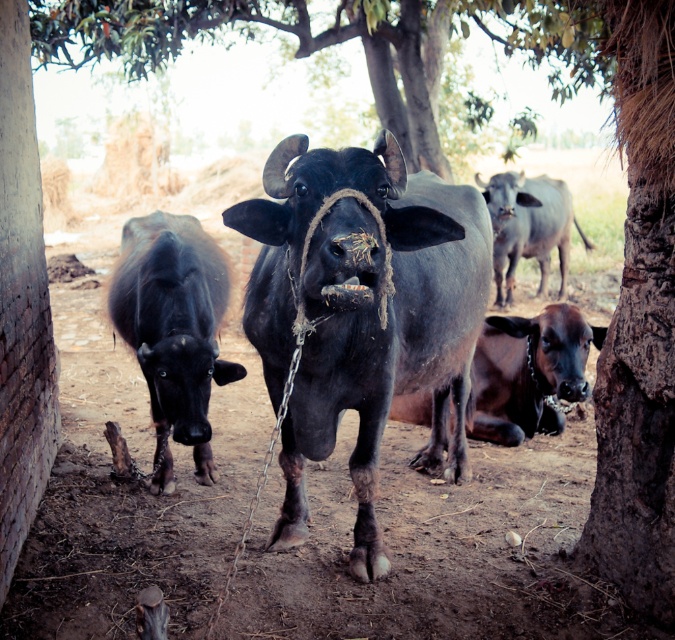
You are a farmer checking the positions of your bulls. You see the shiny black bull at center and the smooth gray bull at upper right. Which bull is positioned lower in the image?

The shiny black bull at center is positioned lower than the smooth gray bull at upper right.